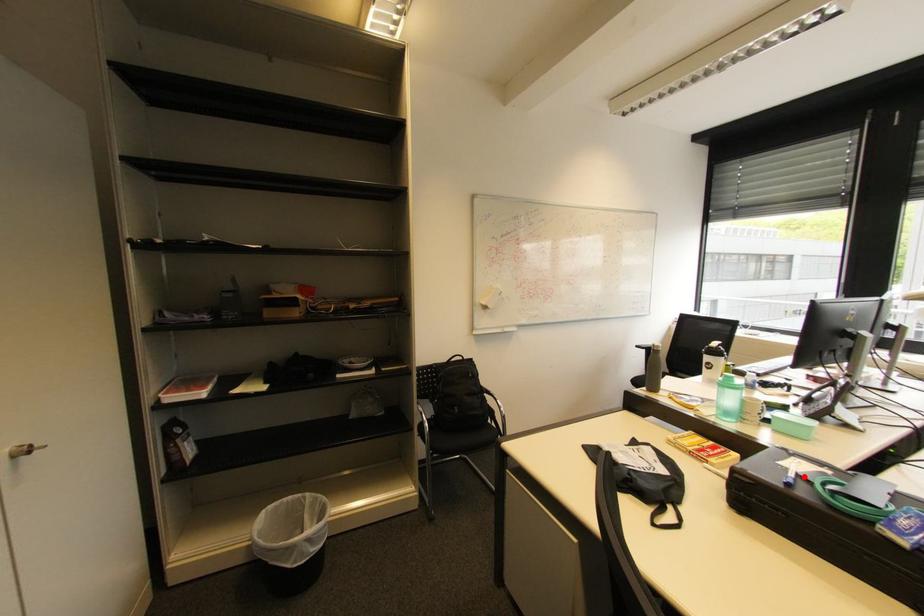
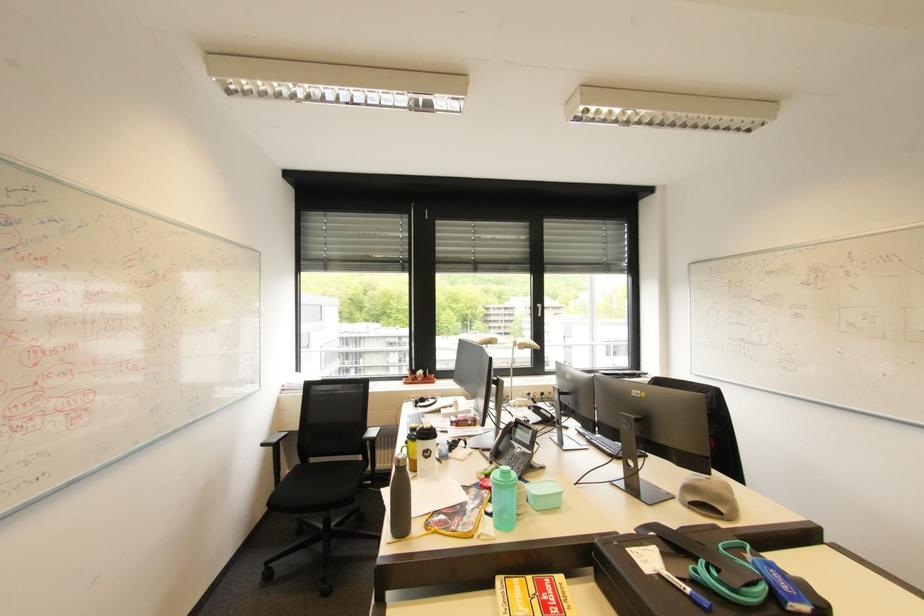
The point at the highlighted location is marked in the first image. Where is the corresponding point in the second image?

(685, 581)